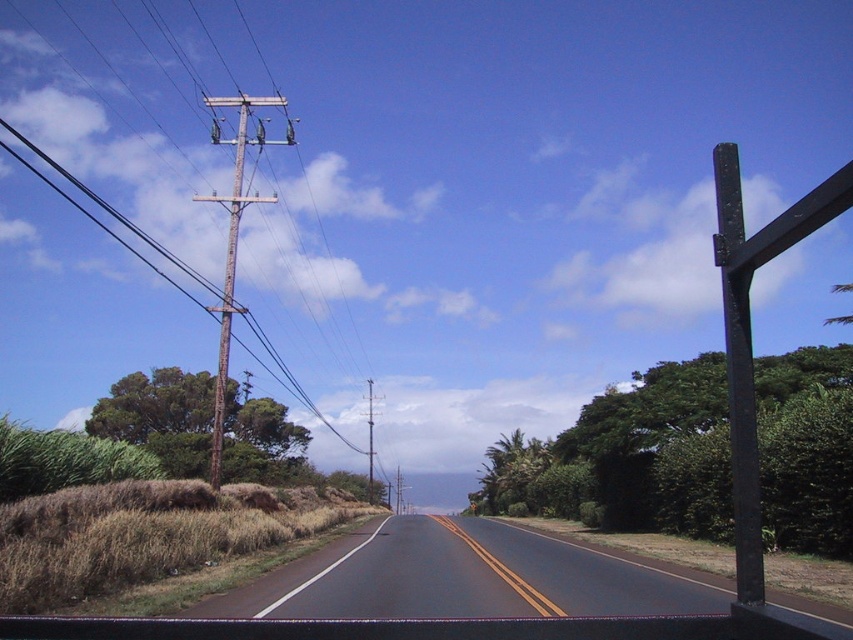
You are driving a car on the road and see the rusty wood pole at left. Where is the pole located relative to the road?

The rusty wood pole at left is located on the left side of the road.

You are a hiker standing on the rural road and want to take a photo of both the green leafy tree at right and the green rough bark tree at left. Which tree should you move closer to in order to include both in the frame without cropping either?

To include both the green leafy tree at right and the green rough bark tree at left in the frame without cropping, you should move closer to the green rough bark tree at left since it is shorter than the green leafy tree at right.